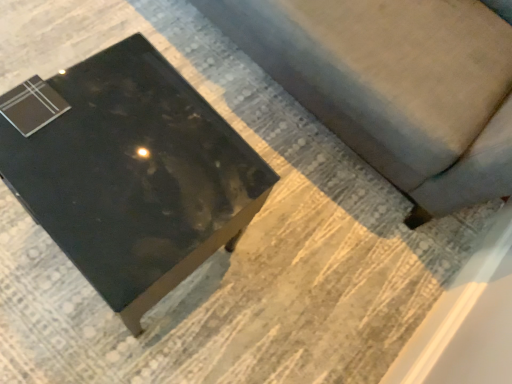
Question: From their relative heights in the image, would you say glossy black table at lower left is taller or shorter than suede-like gray couch at lower right?

Choices:
 (A) tall
 (B) short

Answer: (B)

Question: From a real-world perspective, is glossy black table at lower left above or below suede-like gray couch at lower right?

Choices:
 (A) below
 (B) above

Answer: (A)

Question: Is glossy black table at lower left inside the boundaries of suede-like gray couch at lower right, or outside?

Choices:
 (A) outside
 (B) inside

Answer: (A)

Question: From the image's perspective, is suede-like gray couch at lower right positioned above or below glossy black table at lower left?

Choices:
 (A) below
 (B) above

Answer: (B)

Question: Looking at their shapes, would you say suede-like gray couch at lower right is wider or thinner than glossy black table at lower left?

Choices:
 (A) wide
 (B) thin

Answer: (A)

Question: From their relative heights in the image, would you say suede-like gray couch at lower right is taller or shorter than glossy black table at lower left?

Choices:
 (A) tall
 (B) short

Answer: (A)

Question: Considering the positions of suede-like gray couch at lower right and glossy black table at lower left in the image, is suede-like gray couch at lower right bigger or smaller than glossy black table at lower left?

Choices:
 (A) small
 (B) big

Answer: (B)